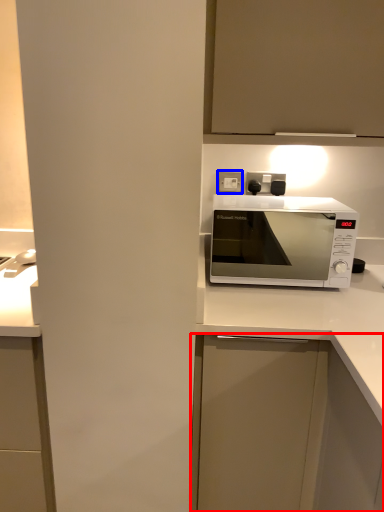
Question: Among these objects, which one is nearest to the camera, cabinetry (highlighted by a red box) or electric outlet (highlighted by a blue box)?

Choices:
 (A) cabinetry
 (B) electric outlet

Answer: (A)